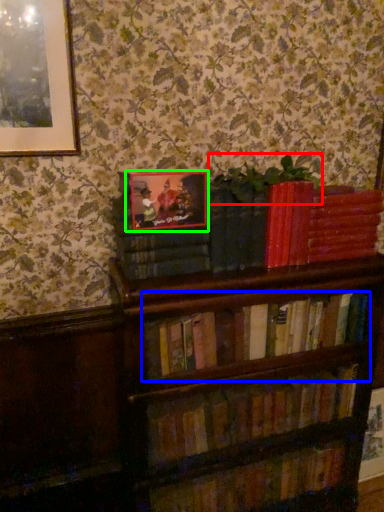
Question: Based on their relative distances, which object is nearer to plant (highlighted by a red box)? Choose from book (highlighted by a blue box) and picture frame (highlighted by a green box).

Choices:
 (A) book
 (B) picture frame

Answer: (B)